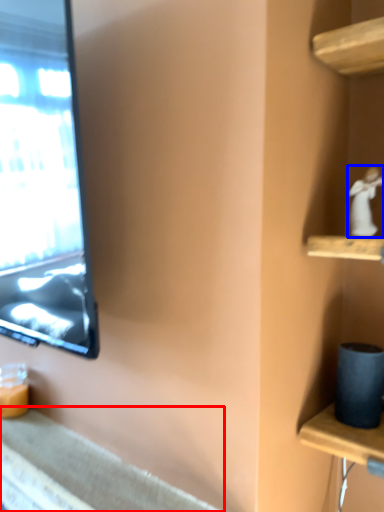
Question: Which object appears farthest to the camera in this image, counter top (highlighted by a red box) or miniature (highlighted by a blue box)?

Choices:
 (A) counter top
 (B) miniature

Answer: (B)